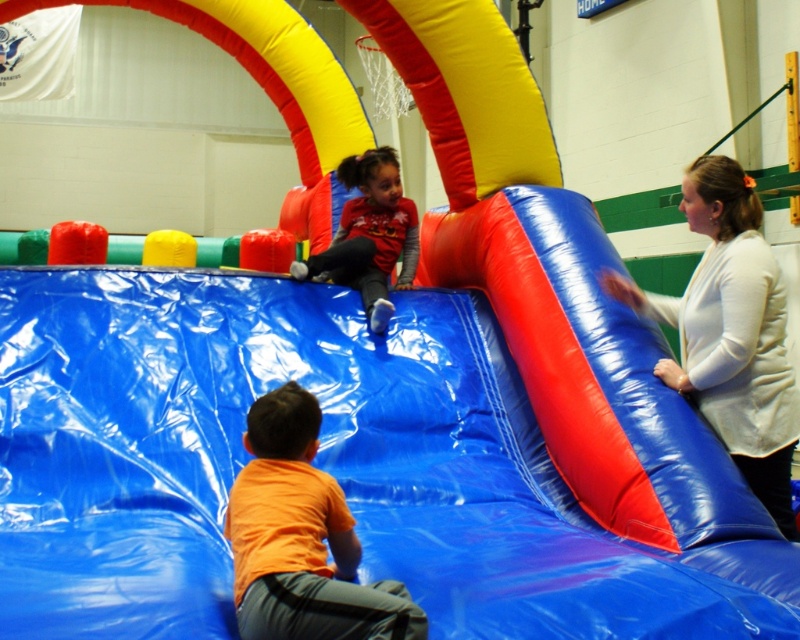
You are a parent standing at the edge of the bouncy castle. You see your child wearing an orange matte shirt at lower center and another child wearing a matte red shirt at upper center. You want to hand your child a water bottle. Which child is closer to you?

The orange matte shirt at lower center is closer to you since it is at the lower center position, while the matte red shirt at upper center is farther away at the upper center position.

You are a parent supervising children at the bouncy castle. You notice a white matte jacket at right and a matte red shirt at upper center. If you want to quickly reach either child in case of an emergency, which direction should you move towards first?

The white matte jacket at right is 2.44 meters away from the matte red shirt at upper center. To reach either child quickly, you should move towards the closer one. However, since the distance between them is the same from your current position, you need to assess which child requires immediate attention based on their behavior or needs.